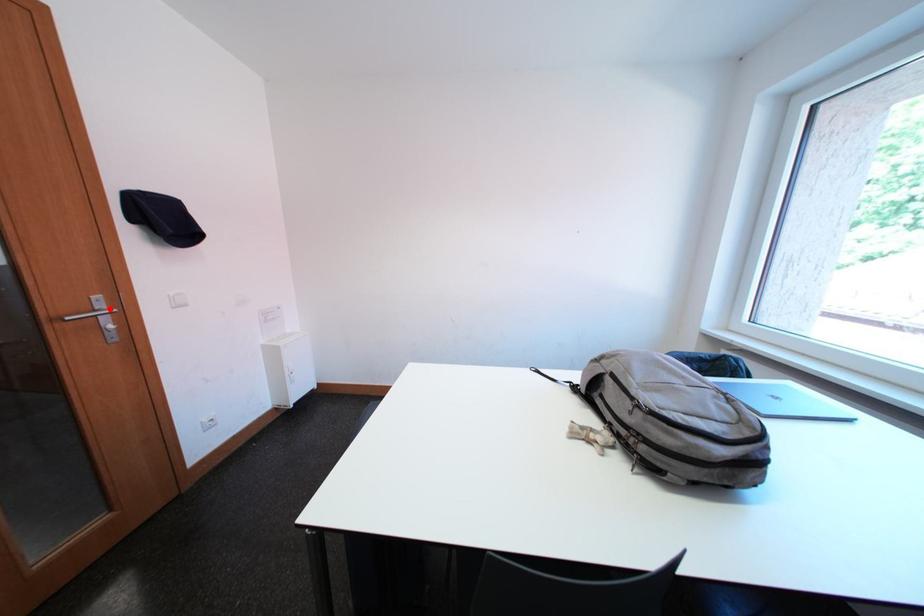
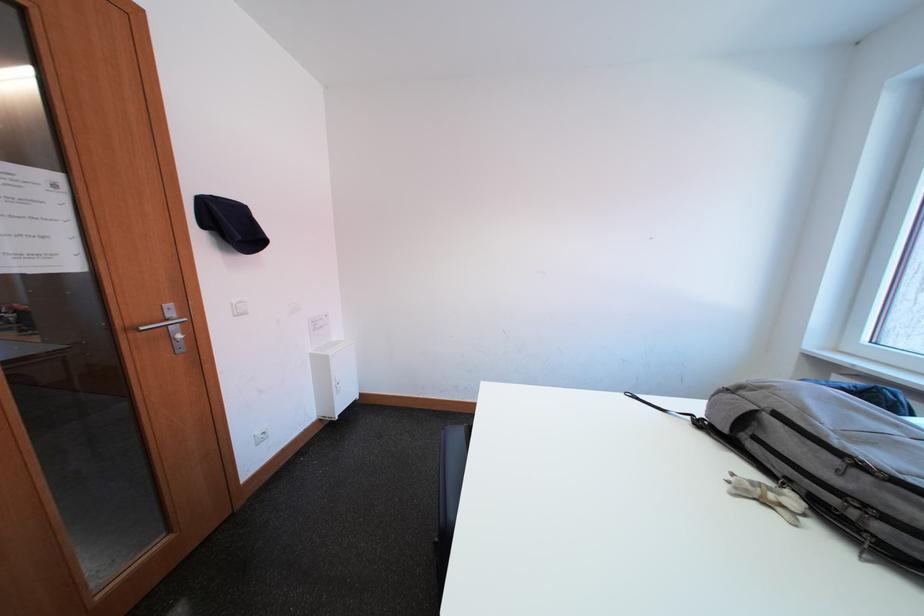
The point at the highlighted location is marked in the first image. Where is the corresponding point in the second image?

(180, 317)